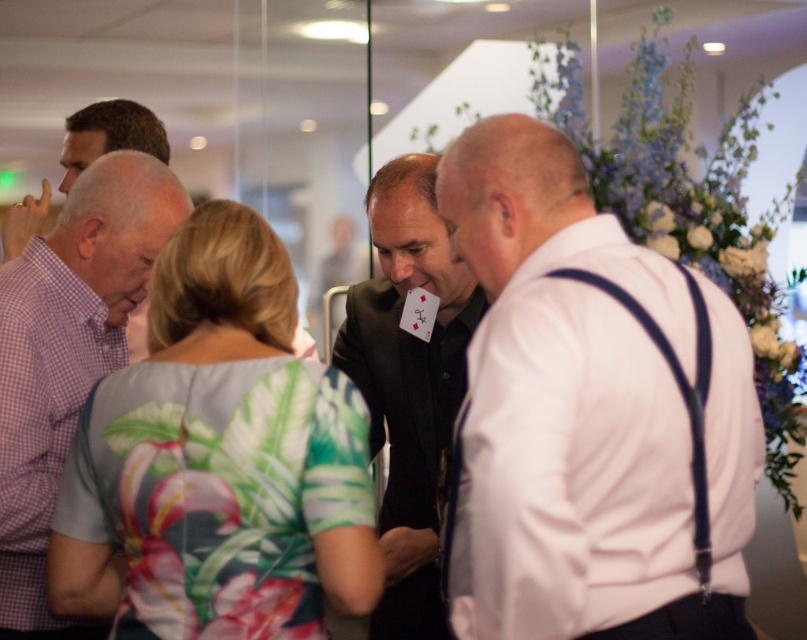
You are at the point labeled point [130,129] and want to move towards the staircase located behind point [500,570]. Is there a clear path between these two points?

Point [500,570] is in front of point [130,129], so there is a clear path between them.

You are at a party and want to join the conversation between the white matte shirt at right and the checkered fabric shirt at left. Which person should you approach first if you want to start near the right side of the group?

You should approach the white matte shirt at right first since they are positioned on the right side of the checkered fabric shirt at left, making them closer to the right side of the group.

You are standing at the center of the image and want to locate the purple checkered shirt at left. According to the coordinate system where the bottom left corner is the origin, which direction should you look to find it?

The purple checkered shirt at left is located at coordinate point 0.548 on the x axis and 0.084 on the y axis. Since the coordinate system has the bottom left corner as the origin, the x value of 0.548 indicates it is to the right of the center, and the y value of 0.084 means it is near the bottom of the image. Therefore, you should look to the right and slightly downward from the center to locate it.